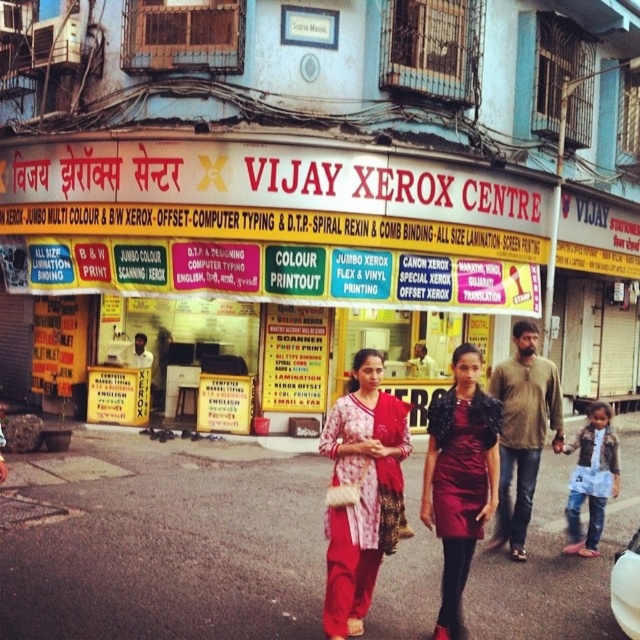
Question: Which point is closer to the camera?

Choices:
 (A) (420, 241)
 (B) (426, 467)

Answer: (B)

Question: Based on their relative distances, which object is nearer to the white shirt at center?

Choices:
 (A) dark brown leather jacket at center
 (B) denim jacket at lower right
 (C) yellow painted signboard at center

Answer: (C)

Question: Is matte red dress at center behind denim jacket at lower right?

Choices:
 (A) no
 (B) yes

Answer: (A)

Question: Where is denim jacket at lower right located in relation to white shirt at center in the image?

Choices:
 (A) below
 (B) above

Answer: (A)

Question: Which of the following is the farthest from the observer?

Choices:
 (A) (340, 458)
 (B) (604, 440)
 (C) (532, 346)

Answer: (B)

Question: Is matte red dress at center wider than denim jacket at lower right?

Choices:
 (A) yes
 (B) no

Answer: (A)